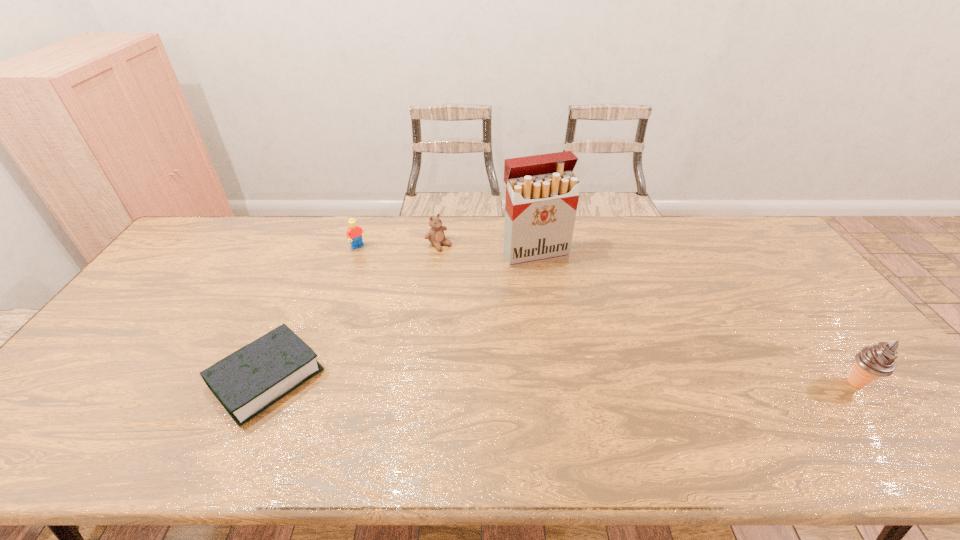
This screenshot has width=960, height=540. In the image, there is a desktop. In order to click on vacant space at the far right corner in this screenshot , I will do `click(765, 248)`.

I want to click on vacant area that lies between the teddy bear and the rightmost object, so click(648, 314).

At what (x,y) coordinates should I click in order to perform the action: click on free space between the teddy bear and the shortest object. Please return your answer as a coordinate pair (x, y). Image resolution: width=960 pixels, height=540 pixels. Looking at the image, I should click on (353, 311).

The width and height of the screenshot is (960, 540). What are the coordinates of `vacant region between the Lego and the teddy bear` in the screenshot? It's located at (399, 246).

Image resolution: width=960 pixels, height=540 pixels. I want to click on free space that is in between the Lego and the second object from right to left, so click(x=447, y=251).

Identify the location of empty space between the tallest object and the teddy bear. Image resolution: width=960 pixels, height=540 pixels. (487, 249).

Locate an element on the screen. This screenshot has width=960, height=540. free space between the Bible and the tallest object is located at coordinates (401, 316).

I want to click on free point between the shortest object and the Lego, so click(x=313, y=313).

Where is `free spot between the teddy bear and the Bible`? The image size is (960, 540). free spot between the teddy bear and the Bible is located at coordinates (353, 311).

The width and height of the screenshot is (960, 540). I want to click on free spot between the Lego and the second tallest object, so click(x=608, y=315).